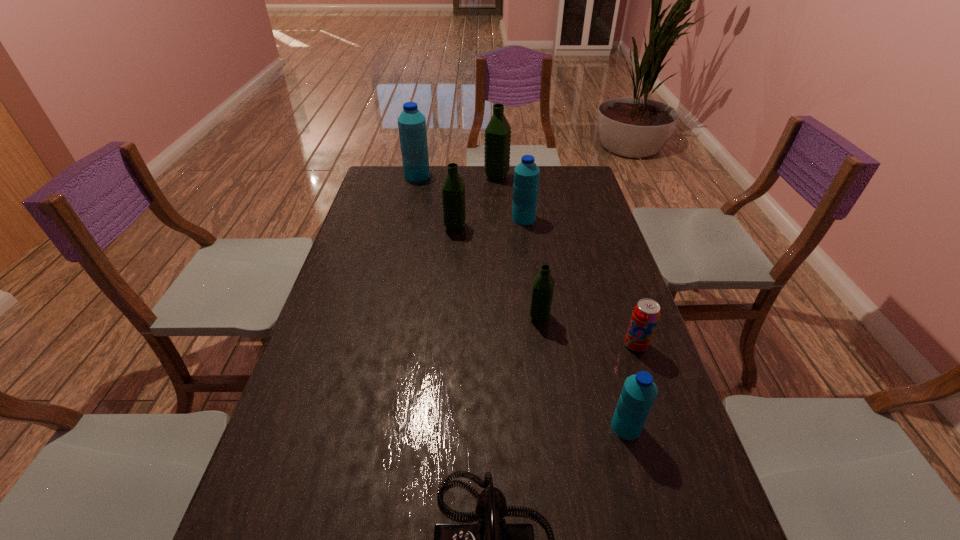
The height and width of the screenshot is (540, 960). Identify the location of the third closest water bottle relative to the biggest blue water bottle. (526, 174).

Image resolution: width=960 pixels, height=540 pixels. Identify the location of water bottle that is the second closest one to the rightmost blue water bottle. (526, 174).

Select which green water bottle is the third closest to the black telephone. Please provide its 2D coordinates. Your answer should be formatted as a tuple, i.e. [(x, y)], where the tuple contains the x and y coordinates of a point satisfying the conditions above.

[(497, 135)]

The width and height of the screenshot is (960, 540). I want to click on the closest green water bottle to the second blue water bottle from left to right, so click(x=453, y=190).

The image size is (960, 540). Identify the location of blue water bottle that stands as the second closest to the nearest water bottle. (411, 123).

The height and width of the screenshot is (540, 960). I want to click on blue water bottle that can be found as the closest to the rightmost blue water bottle, so click(526, 174).

Identify the location of free region that satisfies the following two spatial constraints: 1. on the back side of the second biggest green water bottle; 2. on the left side of the biggest green water bottle. (459, 177).

At what (x,y) coordinates should I click in order to perform the action: click on vacant space that satisfies the following two spatial constraints: 1. on the front side of the soda can; 2. on the left side of the fifth water bottle from right to left. Please return your answer as a coordinate pair (x, y). Looking at the image, I should click on (446, 345).

At what (x,y) coordinates should I click in order to perform the action: click on vacant space that satisfies the following two spatial constraints: 1. on the front side of the leftmost object; 2. on the left side of the smallest green water bottle. Please return your answer as a coordinate pair (x, y). Looking at the image, I should click on (386, 316).